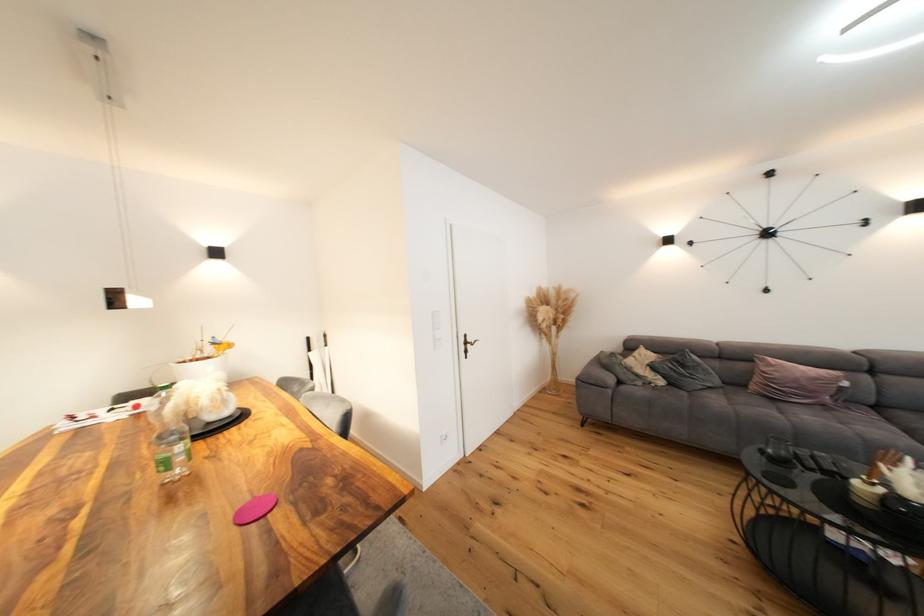
What do you see at coordinates (787, 422) in the screenshot?
I see `the grey sofa sitting surface` at bounding box center [787, 422].